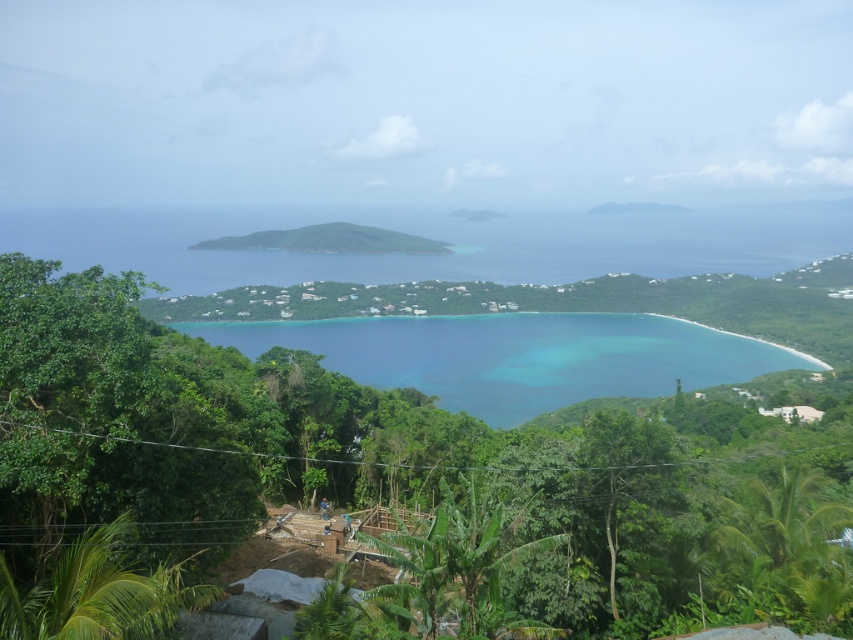
You are a hiker standing at the edge of the tropical coastal landscape. You notice the green leafy trees at center and the turquoise water at center. Which object is closer to you?

The green leafy trees at center are closer to you since they are positioned in front of the turquoise water at center.

You are a surveyor tasked with measuring distances between objects in the scene. Given that the green leafy trees at center and the green leafy hill at center are both visible, how far apart are they?

The green leafy trees at center is 219.59 meters away from green leafy hill at center.

You are a hiker standing at the base of the green leafy hill at center. Looking towards the turquoise water at center, which direction should you go to reach the water?

The turquoise water at center is below the green leafy hill at center, so you should go downhill to reach the turquoise water at center.